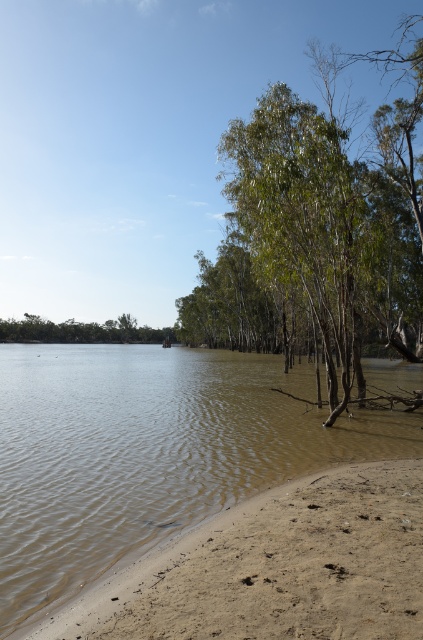
Who is higher up, brown muddy water at lower left or green leafy tree at lower left?

Positioned higher is green leafy tree at lower left.

Which is behind, point (47, 484) or point (62, 339)?

The point (62, 339) is behind.

Where is `brown muddy water at lower left`? brown muddy water at lower left is located at coordinates (147, 451).

This screenshot has height=640, width=423. I want to click on brown muddy water at lower left, so click(147, 451).

Does point (285, 118) come closer to viewer compared to point (43, 340)?

Yes.

The width and height of the screenshot is (423, 640). What do you see at coordinates (318, 227) in the screenshot?
I see `green leafy tree at center` at bounding box center [318, 227].

Image resolution: width=423 pixels, height=640 pixels. I want to click on green leafy tree at center, so click(318, 227).

Is brown muddy water at lower left to the right of green leafy tree at center from the viewer's perspective?

No, brown muddy water at lower left is not to the right of green leafy tree at center.

Between brown muddy water at lower left and green leafy tree at center, which one is positioned lower?

Positioned lower is brown muddy water at lower left.

Where is `brown muddy water at lower left`? brown muddy water at lower left is located at coordinates (147, 451).